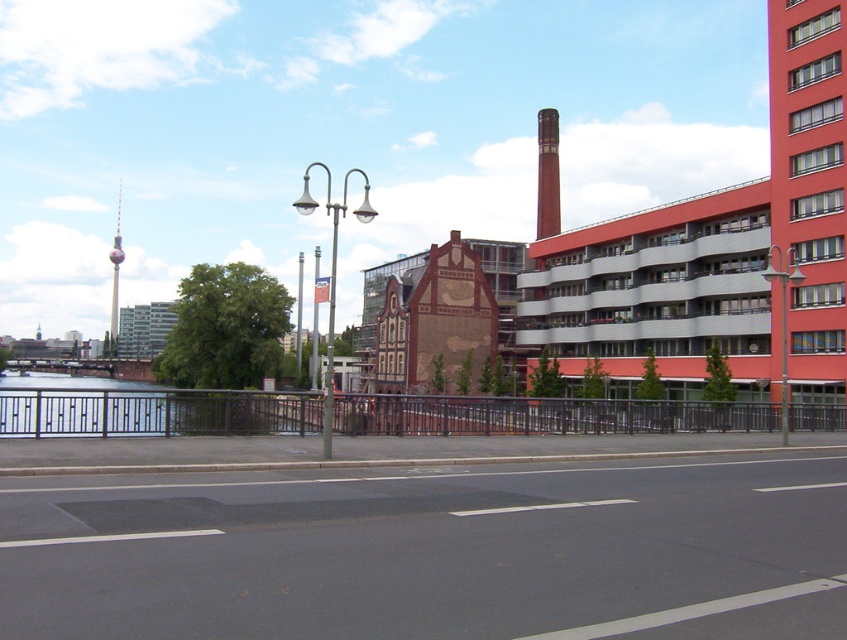
Based on the photo, is metallic water at left below red brick chimney at center?

Indeed, metallic water at left is positioned under red brick chimney at center.

Find the location of a particular element. metallic water at left is located at coordinates (152, 412).

Find the location of a particular element. metallic water at left is located at coordinates [152, 412].